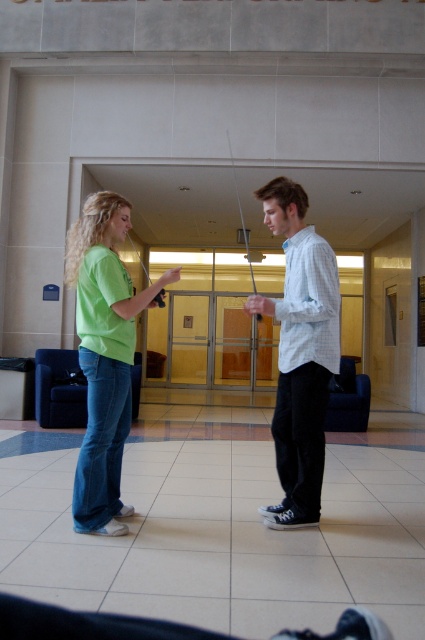
Is point (308, 280) closer to viewer compared to point (122, 353)?

No, (308, 280) is further to viewer.

Is light blue checkered shirt at center thinner than green matte shirt at left?

Yes.

You are a GUI agent. You are given a task and a screenshot of the screen. Output one action in this format:
    pyautogui.click(x=<x>, y=<y>)
    Task: Click on the light blue checkered shirt at center
    The height and width of the screenshot is (640, 425).
    Given the screenshot: What is the action you would take?
    pyautogui.click(x=300, y=353)

Does matte green t-shirt at center lie behind green matte shirt at left?

No, it is in front of green matte shirt at left.

Who is shorter, matte green t-shirt at center or green matte shirt at left?

Standing shorter between the two is green matte shirt at left.

Which is in front, point (130, 308) or point (124, 234)?

Point (130, 308) is more forward.

Find the location of `matte green t-shirt at center`. matte green t-shirt at center is located at coordinates 300,356.

Does matte green t-shirt at center have a greater height compared to light blue checkered shirt at center?

Indeed, matte green t-shirt at center has a greater height compared to light blue checkered shirt at center.

Who is more distant from viewer, (282, 484) or (328, 307)?

The point (282, 484) is behind.

This screenshot has height=640, width=425. Identify the location of matte green t-shirt at center. (300, 356).